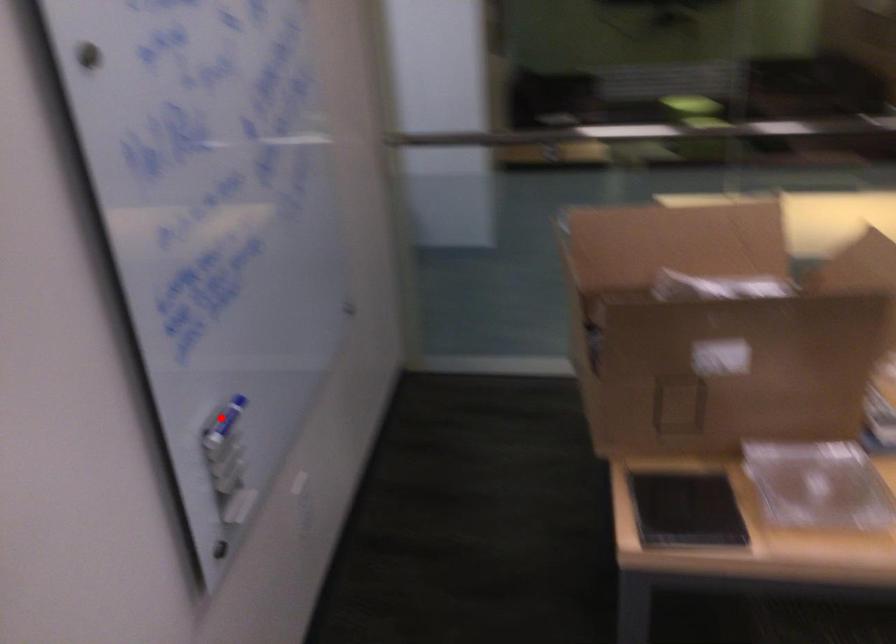
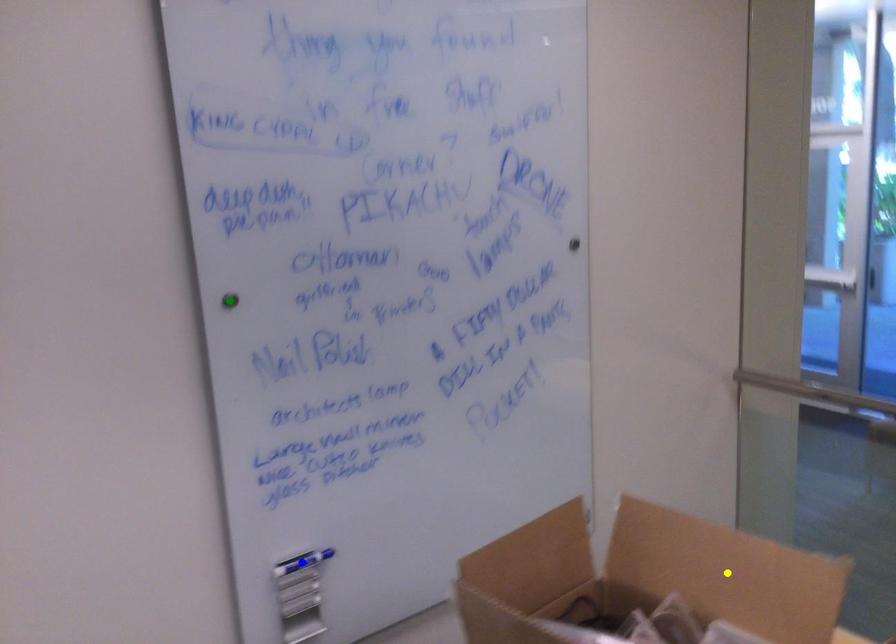
Question: I am providing you with two images of the same scene from different viewpoints. A red point is marked on the first image. You are given multiple points on the second image. In image 2, which mark is for the same physical point as the one in image 1?

Choices:
 (A) yellow point
 (B) green point
 (C) blue point

Answer: (C)